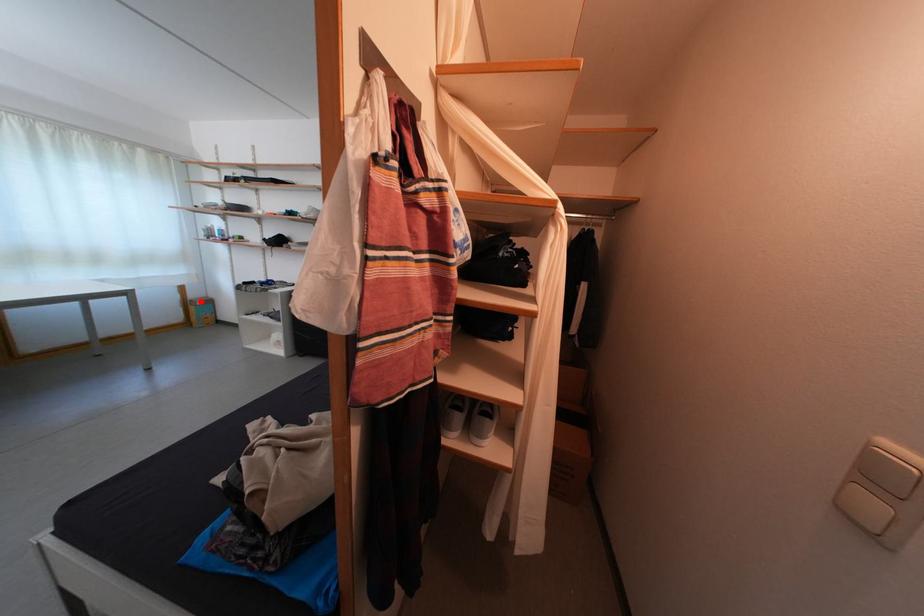
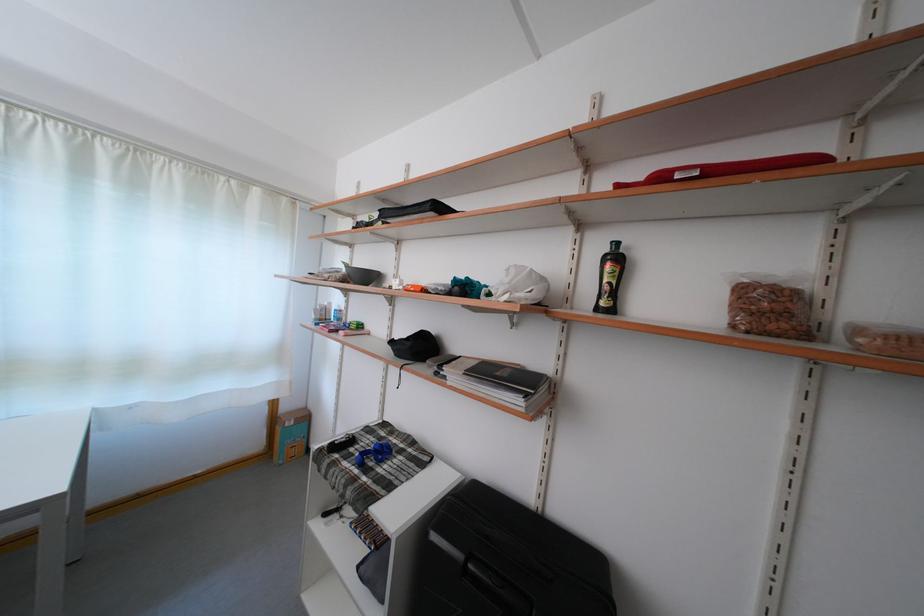
Question: I am providing you with two images of the same scene from different viewpoints. A red point is shown in image1. For the corresponding object point in image2, is it positioned nearer or farther from the camera?

Choices:
 (A) Nearer
 (B) Farther

Answer: (B)